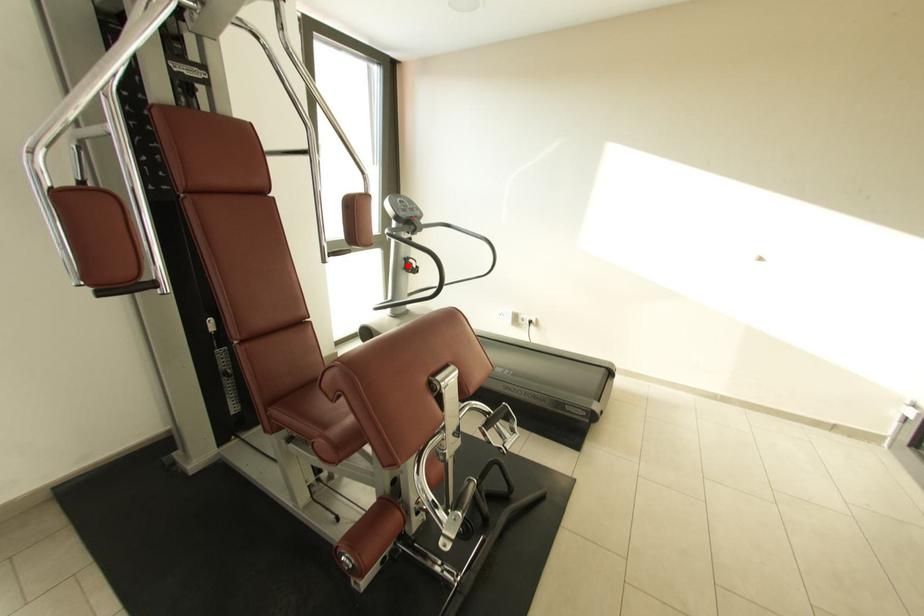
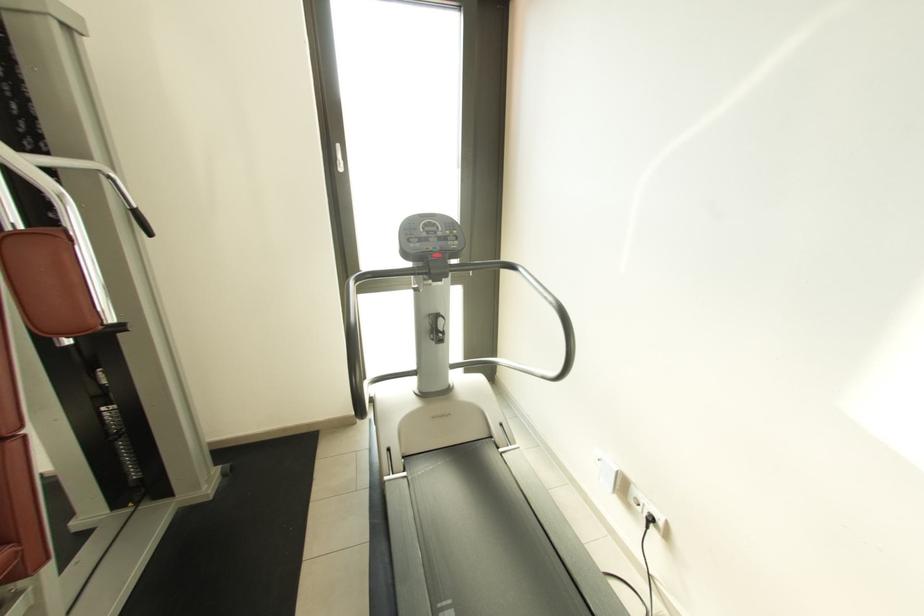
In the second image, find the point that corresponds to the highlighted location in the first image.

(432, 325)